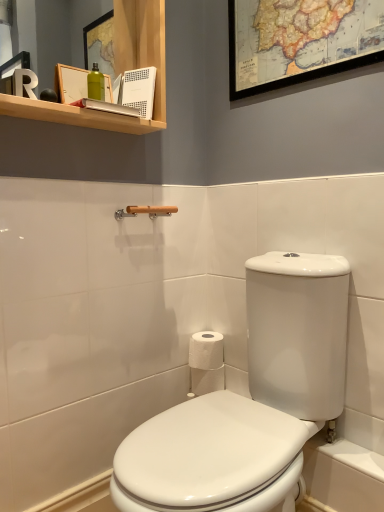
Question: Is white glossy toilet at center outside of white paper at center?

Choices:
 (A) no
 (B) yes

Answer: (B)

Question: Considering the relative sizes of white glossy toilet at center and white paper at center in the image provided, is white glossy toilet at center thinner than white paper at center?

Choices:
 (A) yes
 (B) no

Answer: (B)

Question: Is white glossy toilet at center further to camera compared to white paper at center?

Choices:
 (A) no
 (B) yes

Answer: (A)

Question: Considering the relative sizes of white glossy toilet at center and white paper at center in the image provided, is white glossy toilet at center bigger than white paper at center?

Choices:
 (A) yes
 (B) no

Answer: (A)

Question: Considering the relative sizes of white glossy toilet at center and white paper at center in the image provided, is white glossy toilet at center shorter than white paper at center?

Choices:
 (A) no
 (B) yes

Answer: (A)

Question: From a real-world perspective, is white glossy toilet at center physically located above or below wooden towel bar at upper center?

Choices:
 (A) below
 (B) above

Answer: (A)

Question: In terms of size, does white glossy toilet at center appear bigger or smaller than wooden towel bar at upper center?

Choices:
 (A) small
 (B) big

Answer: (B)

Question: Visually, is white glossy toilet at center positioned to the left or to the right of wooden towel bar at upper center?

Choices:
 (A) right
 (B) left

Answer: (A)

Question: From the image's perspective, is white glossy toilet at center positioned above or below wooden towel bar at upper center?

Choices:
 (A) above
 (B) below

Answer: (B)

Question: In the image, is wooden map at upper center on the left side or the right side of white glossy toilet at center?

Choices:
 (A) left
 (B) right

Answer: (B)

Question: From a real-world perspective, is wooden map at upper center physically located above or below white glossy toilet at center?

Choices:
 (A) below
 (B) above

Answer: (B)

Question: From the image's perspective, is wooden map at upper center above or below white glossy toilet at center?

Choices:
 (A) below
 (B) above

Answer: (B)

Question: Considering their positions, is wooden map at upper center located in front of or behind white glossy toilet at center?

Choices:
 (A) behind
 (B) front

Answer: (A)

Question: In terms of height, does white paper at center look taller or shorter compared to white glossy toilet at center?

Choices:
 (A) tall
 (B) short

Answer: (B)

Question: Considering the positions of white paper at center and white glossy toilet at center in the image, is white paper at center wider or thinner than white glossy toilet at center?

Choices:
 (A) thin
 (B) wide

Answer: (A)